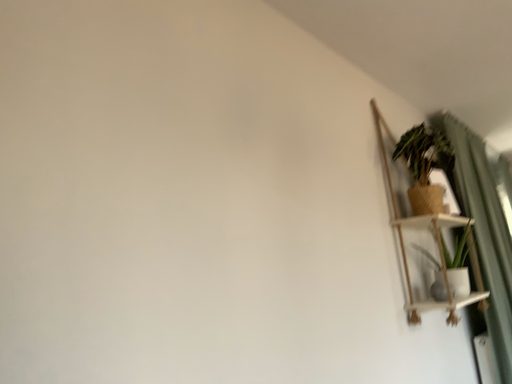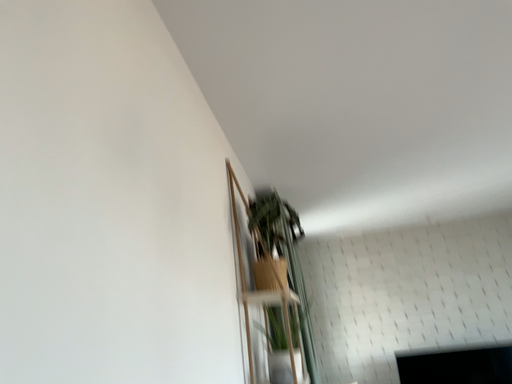
Question: Which way did the camera rotate in the video?

Choices:
 (A) rotated right
 (B) rotated left

Answer: (A)